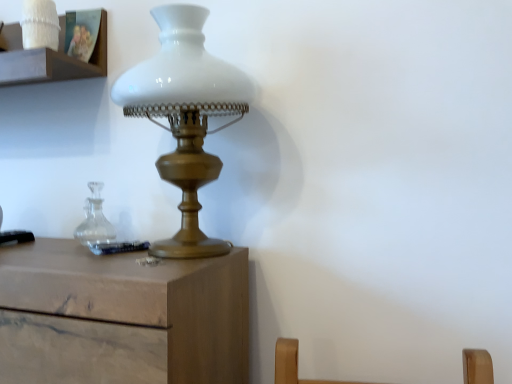
Question: Considering the positions of point (117, 79) and point (53, 34), is point (117, 79) closer or farther from the camera than point (53, 34)?

Choices:
 (A) farther
 (B) closer

Answer: (A)

Question: From the image's perspective, relative to white ceramic candle holder at upper left, is white matte glass lamp at center above or below?

Choices:
 (A) below
 (B) above

Answer: (A)

Question: Based on their positions, is white matte glass lamp at center located to the left or right of white ceramic candle holder at upper left?

Choices:
 (A) right
 (B) left

Answer: (A)

Question: In terms of width, does white ceramic candle holder at upper left look wider or thinner when compared to white matte glass lamp at center?

Choices:
 (A) wide
 (B) thin

Answer: (B)

Question: From their relative heights in the image, would you say white ceramic candle holder at upper left is taller or shorter than white matte glass lamp at center?

Choices:
 (A) tall
 (B) short

Answer: (B)

Question: From the image's perspective, relative to white matte glass lamp at center, is white ceramic candle holder at upper left above or below?

Choices:
 (A) above
 (B) below

Answer: (A)

Question: From a real-world perspective, relative to white matte glass lamp at center, is white ceramic candle holder at upper left vertically above or below?

Choices:
 (A) below
 (B) above

Answer: (B)